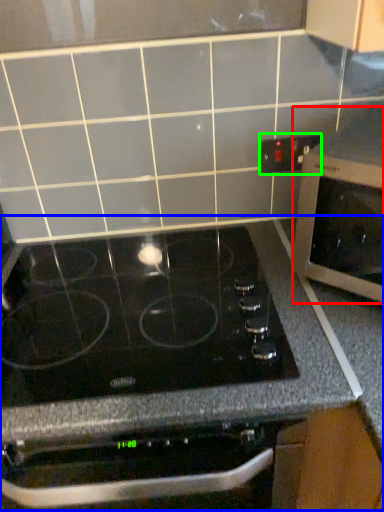
Question: Which is farther away from microwave oven (highlighted by a red box)? counter (highlighted by a blue box) or electric outlet (highlighted by a green box)?

Choices:
 (A) counter
 (B) electric outlet

Answer: (B)